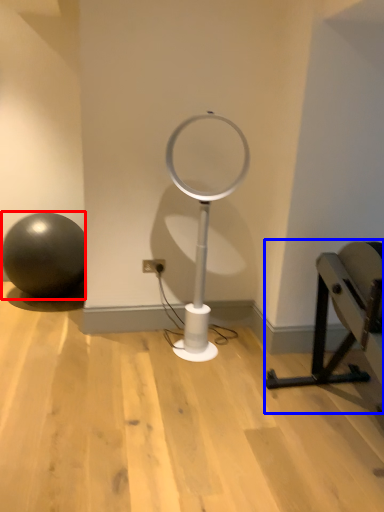
Question: Which object is further to the camera taking this photo, ball (highlighted by a red box) or furniture (highlighted by a blue box)?

Choices:
 (A) ball
 (B) furniture

Answer: (A)